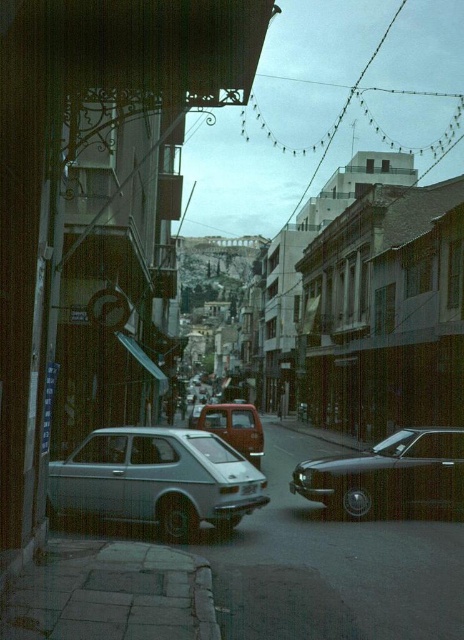
Does light blue matte hatchback at lower left have a larger size compared to white plastic license plate at center?

Correct, light blue matte hatchback at lower left is larger in size than white plastic license plate at center.

Which is more to the right, light blue matte hatchback at lower left or white plastic license plate at center?

Positioned to the right is white plastic license plate at center.

At what (x,y) coordinates should I click in order to perform the action: click on light blue matte hatchback at lower left. Please return your answer as a coordinate pair (x, y). The width and height of the screenshot is (464, 640). Looking at the image, I should click on (155, 481).

Find the location of a particular element. The height and width of the screenshot is (640, 464). light blue matte hatchback at lower left is located at coordinates (155, 481).

Based on the photo, between light blue matte hatchback at lower left and matte red truck at center, which one is positioned higher?

light blue matte hatchback at lower left is higher up.

Does light blue matte hatchback at lower left appear over matte red truck at center?

Yes, light blue matte hatchback at lower left is above matte red truck at center.

Between point (128, 515) and point (219, 428), which one is positioned in front?

Point (128, 515) is in front.

I want to click on light blue matte hatchback at lower left, so click(x=155, y=481).

Does point (384, 508) come behind point (193, 424)?

No.

Who is positioned more to the left, shiny black sedan at center or matte red truck at center?

matte red truck at center

Does point (345, 481) lie in front of point (213, 406)?

Yes, point (345, 481) is in front of point (213, 406).

Find the location of a particular element. shiny black sedan at center is located at coordinates (391, 477).